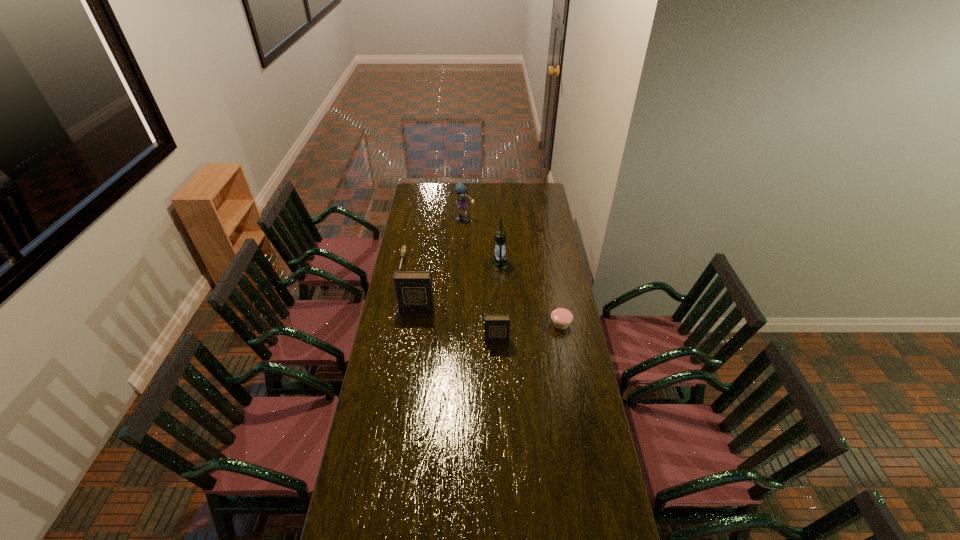
The width and height of the screenshot is (960, 540). Identify the location of the leftmost object. (403, 250).

Locate an element on the screen. free region located 0.050m on the front cover of the left diary is located at coordinates (415, 320).

You are a GUI agent. You are given a task and a screenshot of the screen. Output one action in this format:
    pyautogui.click(x=<x>, y=<y>)
    Task: Click on the blank space located 0.050m on the front cover of the shorter diary
    Image resolution: width=960 pixels, height=540 pixels.
    Given the screenshot: What is the action you would take?
    pyautogui.click(x=497, y=352)

Locate an element on the screen. This screenshot has width=960, height=540. vacant space located 0.140m on the front-facing side of the farthest object is located at coordinates (464, 238).

Where is `free space located 0.320m on the front of the cupcake`? This screenshot has height=540, width=960. free space located 0.320m on the front of the cupcake is located at coordinates (573, 391).

Locate an element on the screen. The height and width of the screenshot is (540, 960). vacant area located on the side where the lantern emits light is located at coordinates (428, 264).

This screenshot has width=960, height=540. I want to click on vacant area located 0.350m on the side where the lantern emits light, so click(426, 264).

The width and height of the screenshot is (960, 540). I want to click on vacant point located on the side where the lantern emits light, so click(448, 264).

Identify the location of vacant area located at the tip of the shortest object. (398, 279).

In order to click on diary that is at the left edge in this screenshot , I will do `click(414, 290)`.